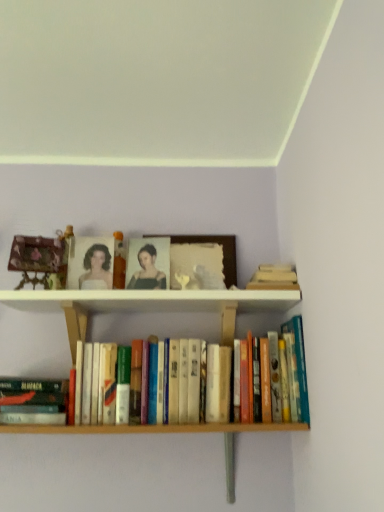
Question: In terms of width, does wooden picture frame at center look wider or thinner when compared to hardcover books at center, marked as the 2th book in a left-to-right arrangement?

Choices:
 (A) wide
 (B) thin

Answer: (B)

Question: Considering the positions of wooden picture frame at center and hardcover books at center, marked as the 2th book in a left-to-right arrangement, in the image, is wooden picture frame at center taller or shorter than hardcover books at center, marked as the 2th book in a left-to-right arrangement,?

Choices:
 (A) tall
 (B) short

Answer: (B)

Question: Which object is positioned closest to the matte black portrait at center?

Choices:
 (A) hardcover books at center, marked as the 2th book in a left-to-right arrangement
 (B) wooden picture frame at center
 (C) hardcover book at lower left, the first book positioned from the left
 (D) wooden carved figurine at left

Answer: (B)

Question: Which is farther from the wooden picture frame at center?

Choices:
 (A) matte black portrait at center
 (B) hardcover books at center, which is the first book from right to left
 (C) wooden carved figurine at left
 (D) hardcover book at lower left, the first book positioned from the left

Answer: (D)